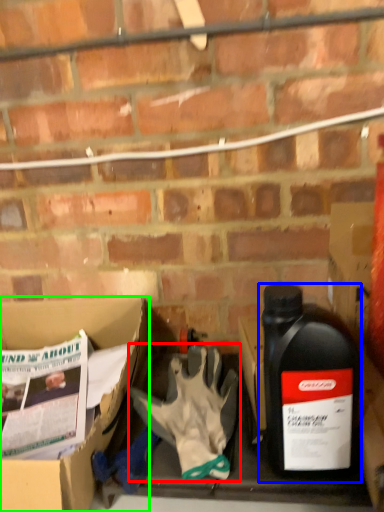
Question: Which is farther away from glove (highlighted by a red box)? bottle (highlighted by a blue box) or box (highlighted by a green box)?

Choices:
 (A) bottle
 (B) box

Answer: (B)